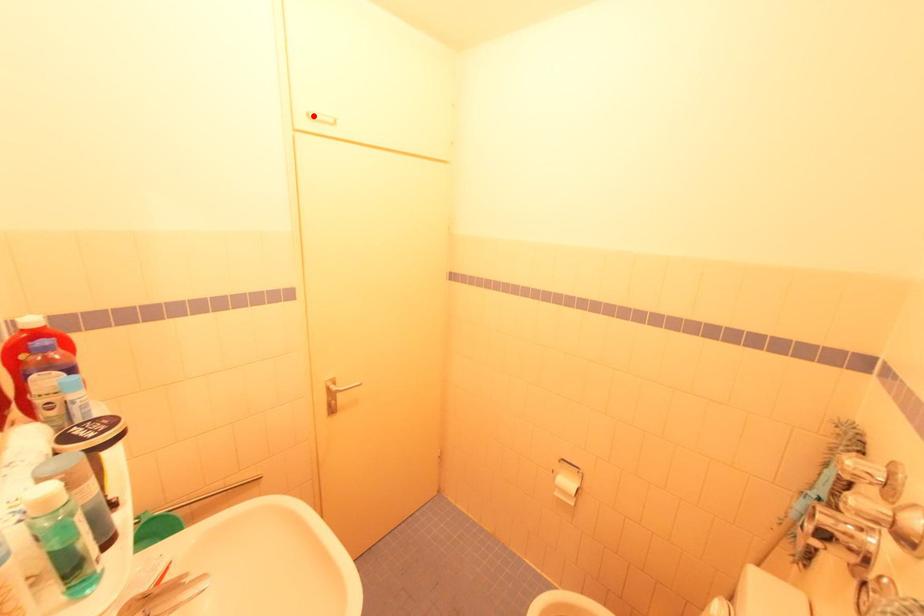
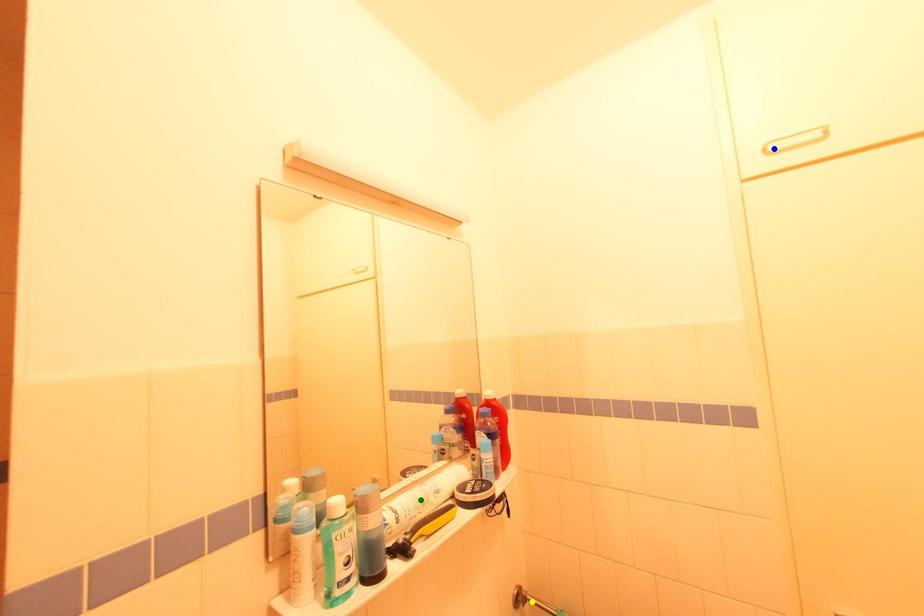
Question: I am providing you with two images of the same scene from different viewpoints. A red point is marked on the first image. You are given multiple points on the second image. Which spot in image 2 lines up with the point in image 1?

Choices:
 (A) yellow point
 (B) blue point
 (C) green point

Answer: (B)